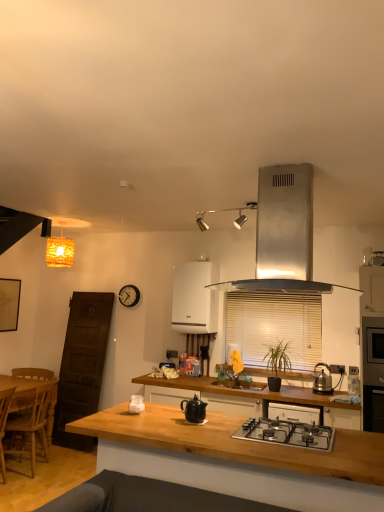
Find the location of a particular element. The width and height of the screenshot is (384, 512). free space in front of white glossy jar at center, the 4th kitchen appliance in the top-to-bottom sequence is located at coordinates (140, 417).